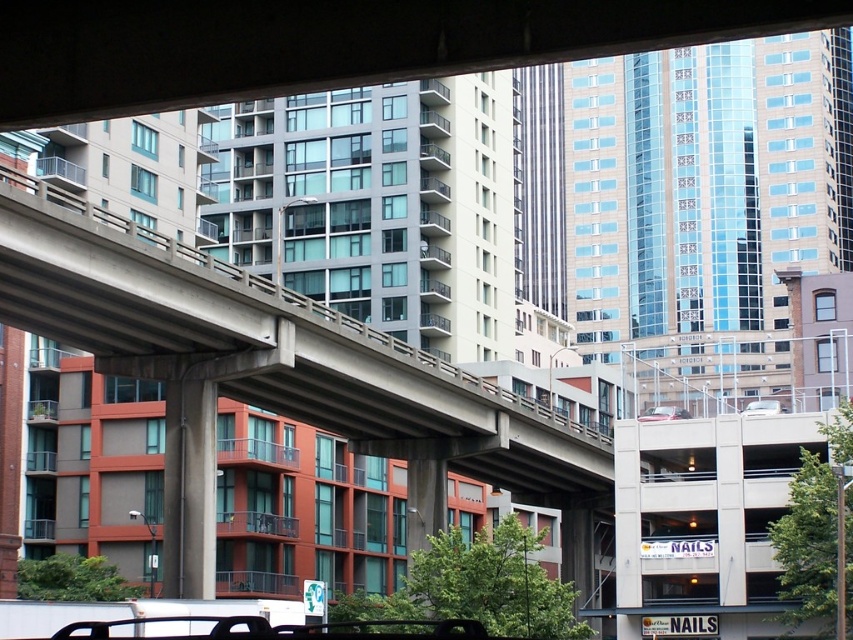
Question: Can you confirm if metallic silver sedan at center is smaller than white matte car at center?

Choices:
 (A) yes
 (B) no

Answer: (B)

Question: Which point is farther from the camera taking this photo?

Choices:
 (A) (32, 282)
 (B) (660, 412)

Answer: (B)

Question: Which of the following is the farthest from the observer?

Choices:
 (A) (415, 433)
 (B) (769, 408)

Answer: (A)

Question: Is concrete at center to the left of white matte car at center from the viewer's perspective?

Choices:
 (A) yes
 (B) no

Answer: (A)

Question: Which point is closer to the camera?

Choices:
 (A) (648, 413)
 (B) (784, 406)
 (C) (219, 342)

Answer: (C)

Question: Does concrete at center have a smaller size compared to metallic silver sedan at center?

Choices:
 (A) no
 (B) yes

Answer: (A)